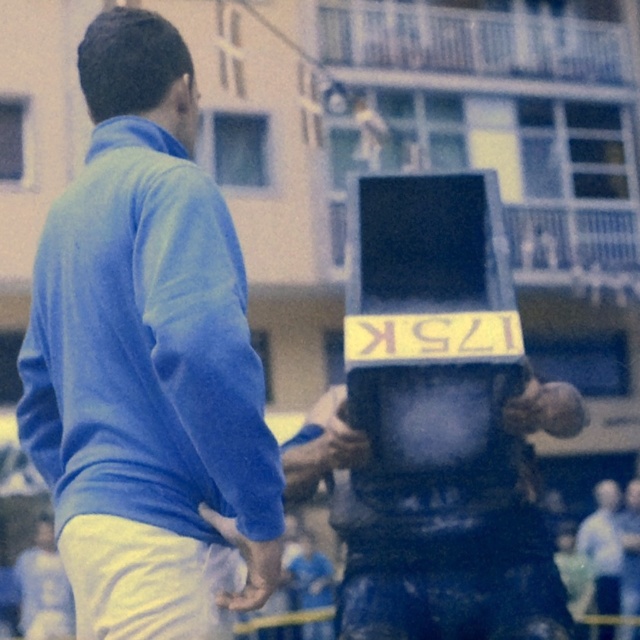
Question: Is the position of blue matte sweater at upper left more distant than that of matte black helmet at center?

Choices:
 (A) no
 (B) yes

Answer: (A)

Question: Can you confirm if light blue fabric pants at lower left is positioned to the left of matte black helmet at center?

Choices:
 (A) yes
 (B) no

Answer: (A)

Question: Can you confirm if blue matte sweater at upper left is wider than light blue fabric pants at lower left?

Choices:
 (A) no
 (B) yes

Answer: (A)

Question: Which of the following is the closest to the observer?

Choices:
 (A) matte black helmet at center
 (B) light blue fabric pants at lower left
 (C) light blue shirt at right
 (D) blue matte sweater at upper left

Answer: (D)

Question: Which point is farther to the camera?

Choices:
 (A) (83, 600)
 (B) (618, 522)

Answer: (B)

Question: Which point is farther to the camera?

Choices:
 (A) (612, 636)
 (B) (241, 465)
 (C) (628, 595)
 (D) (33, 627)

Answer: (C)